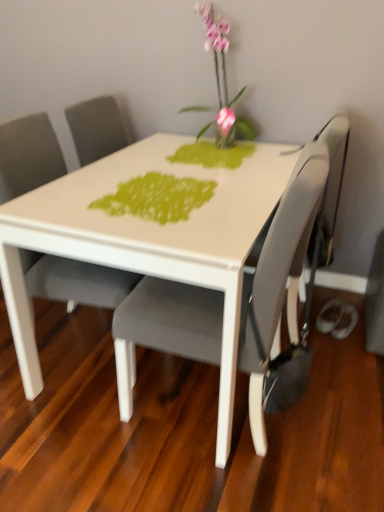
Question: From a real-world perspective, is pink glass vase at upper center positioned under matte gray chair at center, acting as the first chair starting from the right, based on gravity?

Choices:
 (A) no
 (B) yes

Answer: (A)

Question: Does pink glass vase at upper center turn towards matte gray chair at center, acting as the first chair starting from the right?

Choices:
 (A) no
 (B) yes

Answer: (B)

Question: From a real-world perspective, does pink glass vase at upper center stand above matte gray chair at center, the 2th chair viewed from the left?

Choices:
 (A) yes
 (B) no

Answer: (A)

Question: Does pink glass vase at upper center have a greater height compared to matte gray chair at center, the 2th chair viewed from the left?

Choices:
 (A) yes
 (B) no

Answer: (B)

Question: Can you confirm if pink glass vase at upper center is thinner than matte gray chair at center, the 2th chair viewed from the left?

Choices:
 (A) yes
 (B) no

Answer: (A)

Question: Can matte gray chair at center, acting as the first chair starting from the right, be found inside pink glass vase at upper center?

Choices:
 (A) yes
 (B) no

Answer: (B)

Question: Can you confirm if matte gray chair at center, the first chair in the left-to-right sequence, is shorter than matte gray swivel chair at right?

Choices:
 (A) no
 (B) yes

Answer: (A)

Question: Is the position of matte gray chair at center, arranged as the 2th chair when viewed from the right, less distant than that of matte gray swivel chair at right?

Choices:
 (A) yes
 (B) no

Answer: (A)

Question: Is matte gray chair at center, arranged as the 2th chair when viewed from the right, oriented towards matte gray swivel chair at right?

Choices:
 (A) yes
 (B) no

Answer: (B)

Question: Does matte gray chair at center, arranged as the 2th chair when viewed from the right, have a greater width compared to matte gray swivel chair at right?

Choices:
 (A) yes
 (B) no

Answer: (A)

Question: Considering the relative sizes of matte gray chair at center, arranged as the 2th chair when viewed from the right, and matte gray swivel chair at right in the image provided, is matte gray chair at center, arranged as the 2th chair when viewed from the right, thinner than matte gray swivel chair at right?

Choices:
 (A) yes
 (B) no

Answer: (B)

Question: Considering the relative sizes of matte gray chair at center, arranged as the 2th chair when viewed from the right, and matte gray swivel chair at right in the image provided, is matte gray chair at center, arranged as the 2th chair when viewed from the right, taller than matte gray swivel chair at right?

Choices:
 (A) yes
 (B) no

Answer: (A)

Question: From a real-world perspective, is matte gray chair at center, the first chair in the left-to-right sequence, located beneath matte gray chair at center, acting as the first chair starting from the right?

Choices:
 (A) yes
 (B) no

Answer: (B)